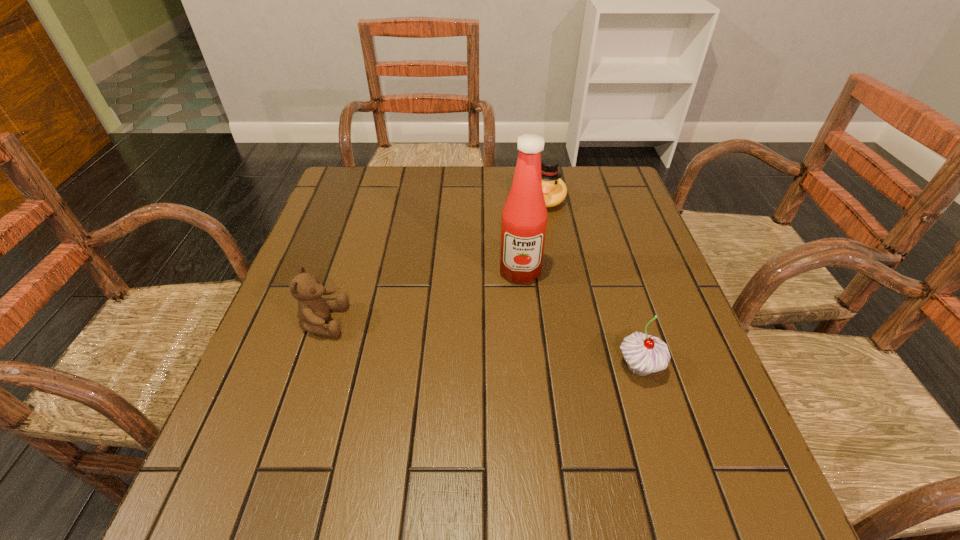
Locate an element on the screen. teddy bear is located at coordinates (313, 310).

Where is `the second nearest object`? This screenshot has height=540, width=960. the second nearest object is located at coordinates (313, 310).

Locate an element on the screen. the nearest object is located at coordinates (644, 354).

The height and width of the screenshot is (540, 960). I want to click on the rightmost object, so click(x=644, y=354).

You are a GUI agent. You are given a task and a screenshot of the screen. Output one action in this format:
    pyautogui.click(x=<x>, y=<y>)
    Task: Click on the farthest object
    This screenshot has width=960, height=540.
    Given the screenshot: What is the action you would take?
    pyautogui.click(x=554, y=189)

Find the location of a particular element. the tallest object is located at coordinates click(x=524, y=217).

The height and width of the screenshot is (540, 960). Find the location of `the second farthest object`. the second farthest object is located at coordinates (524, 217).

You are a GUI agent. You are given a task and a screenshot of the screen. Output one action in this format:
    pyautogui.click(x=<x>, y=<y>)
    Task: Click on the free location located on the front-facing side of the teddy bear
    This screenshot has width=960, height=540.
    Given the screenshot: What is the action you would take?
    pyautogui.click(x=411, y=321)

Find the location of a particular element. free space located 0.150m on the left of the nearest object is located at coordinates (540, 367).

Where is `free space located 0.290m on the front-facing side of the duck`? This screenshot has height=540, width=960. free space located 0.290m on the front-facing side of the duck is located at coordinates (517, 284).